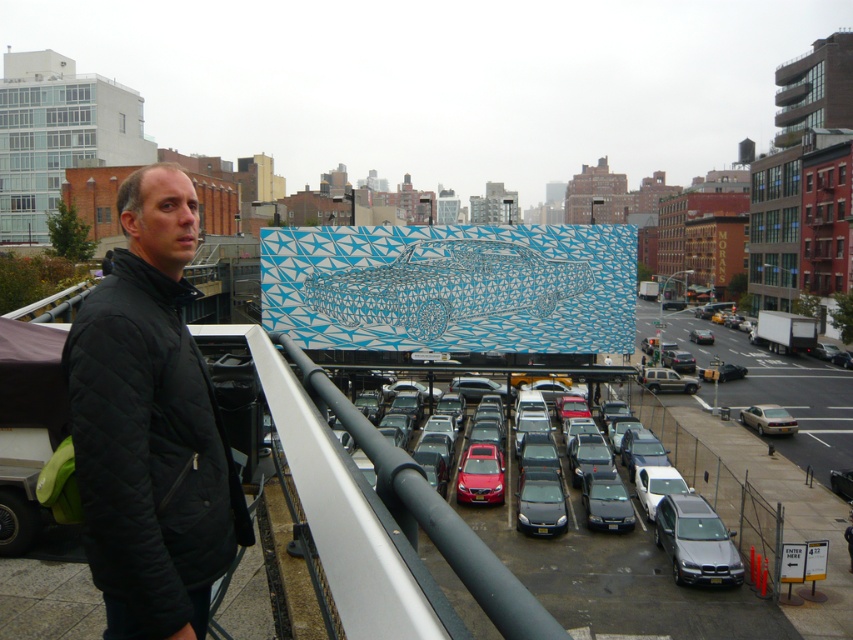
Question: Is satin black sedan at center to the right of silver metallic sedan at center from the viewer's perspective?

Choices:
 (A) yes
 (B) no

Answer: (B)

Question: Is satin silver sedan at lower right positioned before satin black sedan at center?

Choices:
 (A) yes
 (B) no

Answer: (A)

Question: Among these objects, which one is farthest from the camera?

Choices:
 (A) silver metallic sedan at center
 (B) shiny red sedan at center

Answer: (A)

Question: Is metallic silver cars at lower right further to camera compared to satin silver sedan at lower right?

Choices:
 (A) no
 (B) yes

Answer: (B)

Question: Which point appears farthest from the camera in this image?

Choices:
 (A) (653, 384)
 (B) (111, 516)

Answer: (A)

Question: Among these objects, which one is farthest from the camera?

Choices:
 (A) satin silver sedan at lower right
 (B) blue metallic car at center

Answer: (B)